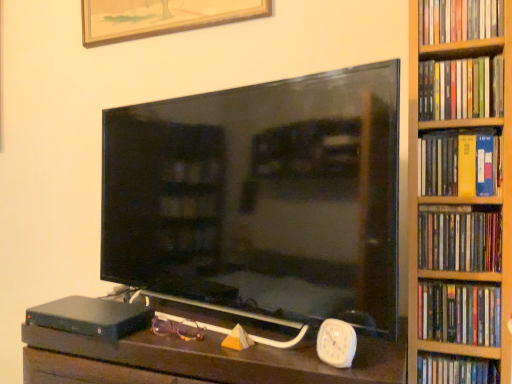
This screenshot has height=384, width=512. I want to click on purple plastic glasses at center, so click(x=177, y=328).

Measure the distance between purple plastic glasses at center and camera.

The depth of purple plastic glasses at center is 36.93 inches.

The width and height of the screenshot is (512, 384). What are the coordinates of `yellow matte book at right, acting as the fourth book starting from the bottom` in the screenshot? It's located at (460, 163).

Describe the element at coordinates (460, 163) in the screenshot. This screenshot has height=384, width=512. I see `yellow matte book at right, acting as the fourth book starting from the bottom` at that location.

Identify the location of matte black tv at center. The image size is (512, 384). (261, 198).

I want to click on hardcover book at right, the 5th book positioned from the bottom, so click(461, 88).

At what (x,y) coordinates should I click in order to perform the action: click on black matte hardcover at lower left. Please return your answer as a coordinate pair (x, y). The width and height of the screenshot is (512, 384). Looking at the image, I should click on (92, 317).

Find the location of a particular element. This screenshot has height=384, width=512. hardcover book at right, arranged as the 1th book when viewed from the top is located at coordinates (459, 20).

The image size is (512, 384). What are the coordinates of `purple plastic glasses at center` in the screenshot? It's located at (177, 328).

Can you confirm if purple plastic glasses at center is shorter than hardcover book at right, the fourth book from the top?

Yes, purple plastic glasses at center is shorter than hardcover book at right, the fourth book from the top.

Is purple plastic glasses at center thinner than hardcover book at right, the fourth book from the top?

Indeed, purple plastic glasses at center has a lesser width compared to hardcover book at right, the fourth book from the top.

Is purple plastic glasses at center bigger or smaller than hardcover book at right, placed as the 3th book when sorted from bottom to top?

Clearly, purple plastic glasses at center is smaller in size than hardcover book at right, placed as the 3th book when sorted from bottom to top.

Identify the location of the 3rd book in front when counting from the purple plastic glasses at center. (459, 238).

Would you say hardcover book at right, the 5th book positioned from the bottom, is inside or outside hardcover book at right, which is the 6th book from bottom to top?

hardcover book at right, the 5th book positioned from the bottom, is not enclosed by hardcover book at right, which is the 6th book from bottom to top.

What's the angular difference between hardcover book at right, the 5th book positioned from the bottom, and hardcover book at right, arranged as the 1th book when viewed from the top,'s facing directions?

The facing directions of hardcover book at right, the 5th book positioned from the bottom, and hardcover book at right, arranged as the 1th book when viewed from the top, are 0 degrees apart.

From the image's perspective, which object appears higher, hardcover book at right, the 5th book positioned from the bottom, or hardcover book at right, which is the 6th book from bottom to top?

hardcover book at right, which is the 6th book from bottom to top.

Could you tell me if matte black tv at center is turned towards hardcover book at right, the 5th book positioned from the bottom?

No, matte black tv at center is not oriented towards hardcover book at right, the 5th book positioned from the bottom.

Is point (354, 286) in front of point (418, 78)?

Yes, it is.

From the image's perspective, does matte black tv at center appear higher than hardcover book at right, the 5th book positioned from the bottom?

Actually, matte black tv at center appears below hardcover book at right, the 5th book positioned from the bottom, in the image.

Is matte black tv at center in front of or behind hardcover book at right, the second book from the top, in the image?

matte black tv at center is positioned closer to the viewer than hardcover book at right, the second book from the top.

Is hardcover book at right, which is the 6th book in top-to-bottom order, oriented towards purple plastic glasses at center?

No, hardcover book at right, which is the 6th book in top-to-bottom order, is not facing towards purple plastic glasses at center.

Can you see hardcover book at right, which is the 6th book in top-to-bottom order, touching purple plastic glasses at center?

No, hardcover book at right, which is the 6th book in top-to-bottom order, is not making contact with purple plastic glasses at center.

Locate an element on the screen. book below the purple plastic glasses at center (from the image's perspective) is located at coordinates (456, 369).

Considering the positions of objects hardcover book at right, positioned as the first book in bottom-to-top order, and purple plastic glasses at center in the image provided, who is in front, hardcover book at right, positioned as the first book in bottom-to-top order, or purple plastic glasses at center?

hardcover book at right, positioned as the first book in bottom-to-top order.

Relative to black matte hardcover at lower left, is hardcover book at right, which is the 6th book in top-to-bottom order, in front or behind?

hardcover book at right, which is the 6th book in top-to-bottom order, is in front of black matte hardcover at lower left.

Considering the positions of objects hardcover book at right, positioned as the first book in bottom-to-top order, and black matte hardcover at lower left in the image provided, who is more to the left, hardcover book at right, positioned as the first book in bottom-to-top order, or black matte hardcover at lower left?

black matte hardcover at lower left.

Are hardcover book at right, which is the 6th book in top-to-bottom order, and black matte hardcover at lower left located far from each other?

No, hardcover book at right, which is the 6th book in top-to-bottom order, is not far away from black matte hardcover at lower left.

Is hardcover book at right, which is the 6th book in top-to-bottom order, surrounding black matte hardcover at lower left?

No, black matte hardcover at lower left is not inside hardcover book at right, which is the 6th book in top-to-bottom order.

Which is behind, white plastic clock at lower right or yellow matte book at right, acting as the fourth book starting from the bottom?

yellow matte book at right, acting as the fourth book starting from the bottom, is further away from the camera.

Which is further, (326, 362) or (461, 148)?

The point (461, 148) is farther.

Looking at this image, from the image's perspective, would you say white plastic clock at lower right is positioned over yellow matte book at right, the 3th book in the top-to-bottom sequence?

No, from the image's perspective, white plastic clock at lower right is not on top of yellow matte book at right, the 3th book in the top-to-bottom sequence.

Can you tell me how much hardcover book at right, which is the 5th book in top-to-bottom order, and hardcover book at right, which is the 6th book from bottom to top, differ in facing direction?

The angular difference between hardcover book at right, which is the 5th book in top-to-bottom order, and hardcover book at right, which is the 6th book from bottom to top, is 0.00518 degrees.

At what (x,y) coordinates should I click in order to perform the action: click on the 4th book to the right of the hardcover book at right, which is the 6th book from bottom to top, starting your count from the anchor. Please return your answer as a coordinate pair (x, y). The image size is (512, 384). Looking at the image, I should click on (459, 313).

Are hardcover book at right, which is the 5th book in top-to-bottom order, and hardcover book at right, arranged as the 1th book when viewed from the top, located far from each other?

No, hardcover book at right, which is the 5th book in top-to-bottom order, is not far away from hardcover book at right, arranged as the 1th book when viewed from the top.

The height and width of the screenshot is (384, 512). I want to click on glasses lying behind the hardcover book at right, placed as the 3th book when sorted from bottom to top, so click(177, 328).

The width and height of the screenshot is (512, 384). I want to click on book that is the 1st one when counting rightward from the hardcover book at right, which is the 6th book from bottom to top, so click(461, 88).

When comparing their distances from matte black tv at center, does white plastic clock at lower right or hardcover book at right, the fourth book from the top, seem further?

hardcover book at right, the fourth book from the top.

Considering their positions, is black matte hardcover at lower left positioned further to matte black tv at center than purple plastic glasses at center?

Among the two, purple plastic glasses at center is located further to matte black tv at center.

Looking at the image, which one is located closer to hardcover book at right, placed as the 3th book when sorted from bottom to top, white plastic clock at lower right or yellow matte book at right, the 3th book in the top-to-bottom sequence?

yellow matte book at right, the 3th book in the top-to-bottom sequence, lies closer to hardcover book at right, placed as the 3th book when sorted from bottom to top, than the other object.

Looking at the image, which one is located further to hardcover book at right, placed as the 3th book when sorted from bottom to top, yellow matte book at right, the 3th book in the top-to-bottom sequence, or white plastic clock at lower right?

white plastic clock at lower right lies further to hardcover book at right, placed as the 3th book when sorted from bottom to top, than the other object.

Based on their spatial positions, is hardcover book at right, the second book from the top, or hardcover book at right, which is the 6th book from bottom to top, closer to hardcover book at right, which is the 6th book in top-to-bottom order?

Among the two, hardcover book at right, the second book from the top, is located nearer to hardcover book at right, which is the 6th book in top-to-bottom order.

From the image, which object appears to be nearer to hardcover book at right, arranged as the 1th book when viewed from the top, hardcover book at right, which is the 5th book in top-to-bottom order, or yellow matte book at right, acting as the fourth book starting from the bottom?

yellow matte book at right, acting as the fourth book starting from the bottom, lies closer to hardcover book at right, arranged as the 1th book when viewed from the top, than the other object.

Estimate the real-world distances between objects in this image. Which object is further from hardcover book at right, which is the 6th book in top-to-bottom order, hardcover book at right, placed as the 3th book when sorted from bottom to top, or white plastic clock at lower right?

white plastic clock at lower right lies further to hardcover book at right, which is the 6th book in top-to-bottom order, than the other object.

Based on their spatial positions, is white plastic clock at lower right or hardcover book at right, which is the 6th book in top-to-bottom order, closer to yellow matte book at right, acting as the fourth book starting from the bottom?

white plastic clock at lower right is closer to yellow matte book at right, acting as the fourth book starting from the bottom.

At what (x,y) coordinates should I click in order to perform the action: click on television between purple plastic glasses at center and white plastic clock at lower right from left to right. Please return your answer as a coordinate pair (x, y). This screenshot has height=384, width=512. Looking at the image, I should click on (261, 198).

Identify the location of clock between black matte hardcover at lower left and hardcover book at right, the second book from the top, in the horizontal direction. The height and width of the screenshot is (384, 512). (336, 343).

Locate an element on the screen. television between purple plastic glasses at center and hardcover book at right, the second book positioned from the bottom, in the horizontal direction is located at coordinates (261, 198).

Find the location of a particular element. glasses located between black matte hardcover at lower left and hardcover book at right, the 5th book positioned from the bottom, in the left-right direction is located at coordinates (177, 328).